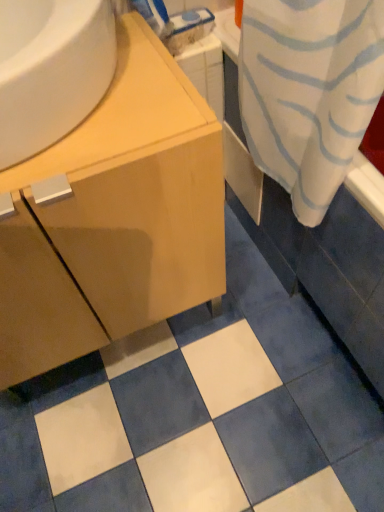
Question: In terms of height, does wooden counter at upper left look taller or shorter compared to light wood cabinet at center?

Choices:
 (A) tall
 (B) short

Answer: (B)

Question: Based on their positions, is wooden counter at upper left located to the left or right of light wood cabinet at center?

Choices:
 (A) right
 (B) left

Answer: (A)

Question: Is wooden counter at upper left inside or outside of light wood cabinet at center?

Choices:
 (A) outside
 (B) inside

Answer: (A)

Question: From a real-world perspective, is light wood cabinet at center physically located above or below wooden counter at upper left?

Choices:
 (A) below
 (B) above

Answer: (A)

Question: Is light wood cabinet at center inside or outside of wooden counter at upper left?

Choices:
 (A) inside
 (B) outside

Answer: (B)

Question: Visually, is light wood cabinet at center positioned to the left or to the right of wooden counter at upper left?

Choices:
 (A) right
 (B) left

Answer: (B)

Question: Is light wood cabinet at center bigger or smaller than wooden counter at upper left?

Choices:
 (A) small
 (B) big

Answer: (B)